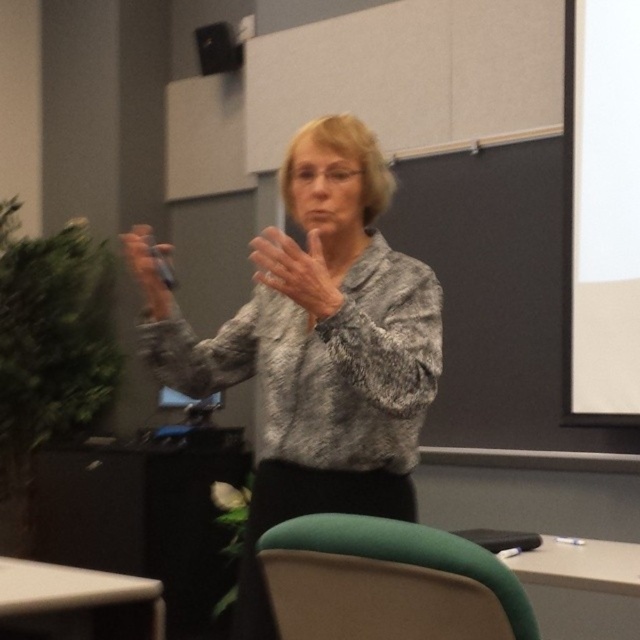
You are a student sitting in the front row of the classroom. You need to look at both the white matte projection screen at upper right and the matte black speaker at upper center. Which object will you look up to first?

The matte black speaker at upper center is located above the white matte projection screen at upper right, so you will look up to the matte black speaker at upper center first.

In the scene shown: You are an assistant in a classroom. You see the matte black remote at upper left and the matte black speaker at upper center. Which object is bigger?

The matte black remote at upper left is larger in size compared to the matte black speaker at upper center.